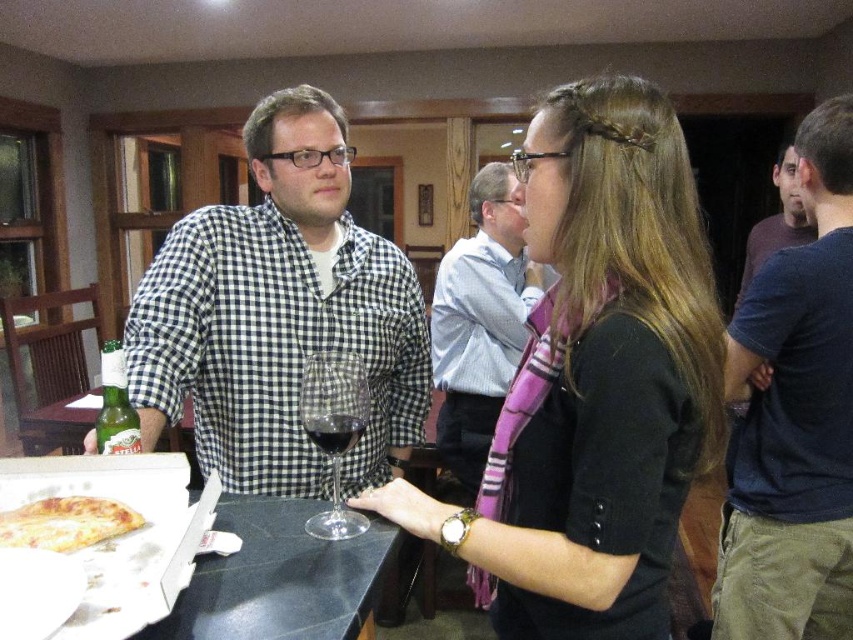
Question: Which point is farther to the camera?

Choices:
 (A) (335, 436)
 (B) (576, 602)

Answer: (A)

Question: Is golden crispy pizza at center above dark glass wine at center?

Choices:
 (A) yes
 (B) no

Answer: (B)

Question: Is checkered fabric shirt at left to the right of transparent glass at center from the viewer's perspective?

Choices:
 (A) yes
 (B) no

Answer: (B)

Question: Can you confirm if black matte jacket at center is smaller than golden crispy pizza at center?

Choices:
 (A) no
 (B) yes

Answer: (A)

Question: Which is farther from the transparent glass at center?

Choices:
 (A) black matte jacket at center
 (B) checkered fabric shirt at left
 (C) golden crispy pizza at center
 (D) light blue shirt at center

Answer: (D)

Question: Which object is positioned closest to the dark glass wine at center?

Choices:
 (A) dark blue t-shirt at right
 (B) light blue shirt at center
 (C) transparent glass at center
 (D) green glass bottle at left

Answer: (C)